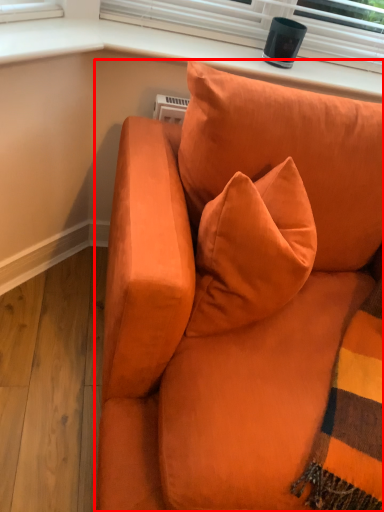
Question: From the image's perspective, where is studio couch (annotated by the red box) located relative to window sill?

Choices:
 (A) below
 (B) above

Answer: (A)